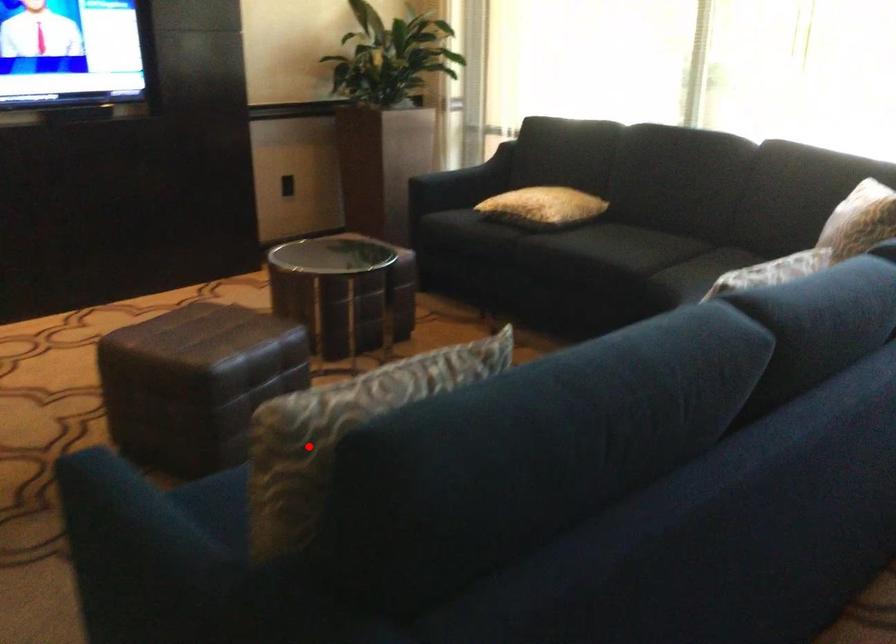
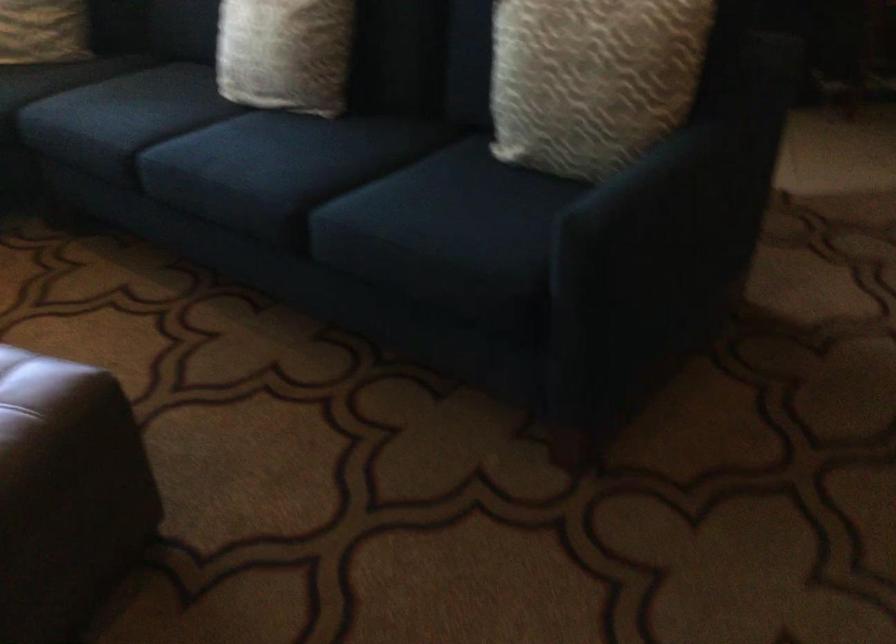
Where in the second image is the point corresponding to the highlighted location from the first image?

(591, 80)